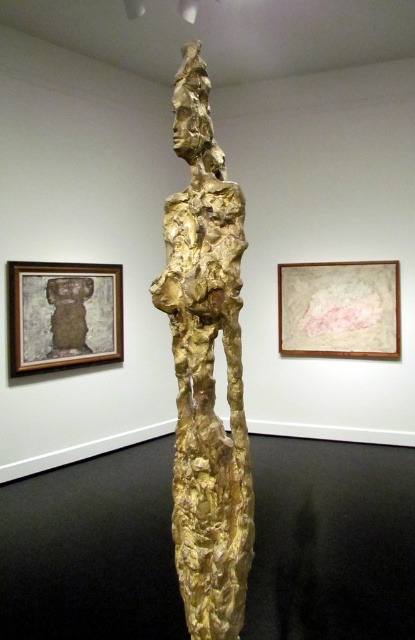
You are an art critic analyzing the spatial arrangement of the artworks in the gallery. Which object, the wooden framed artwork at upper left or the matte pink paper at upper center, is positioned closer to the observer?

The wooden framed artwork at upper left is closer to the viewer than the matte pink paper at upper center.

You are an art critic standing in front of the gold textured sculpture at center and the matte pink paper at upper center. Which object is nearer to you?

The gold textured sculpture at center is closer to the viewer than the matte pink paper at upper center.

You are an art critic standing in the gallery. You notice the gold textured sculpture at center and the matte pink paper at upper center. Which object is positioned higher in the image?

The matte pink paper at upper center is positioned higher than the gold textured sculpture at center.